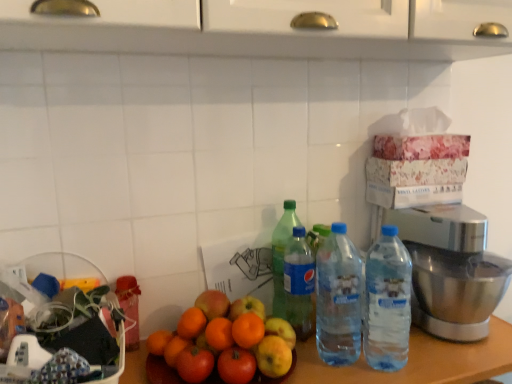
Question: Does wooden table at center touch green plastic bottle at center, arranged as the 4th bottle when viewed from the right?

Choices:
 (A) yes
 (B) no

Answer: (B)

Question: Can you confirm if wooden table at center is wider than green plastic bottle at center, arranged as the first bottle when viewed from the left?

Choices:
 (A) yes
 (B) no

Answer: (A)

Question: From a real-world perspective, is wooden table at center below green plastic bottle at center, arranged as the first bottle when viewed from the left?

Choices:
 (A) no
 (B) yes

Answer: (B)

Question: Would you say wooden table at center is outside green plastic bottle at center, arranged as the first bottle when viewed from the left?

Choices:
 (A) yes
 (B) no

Answer: (A)

Question: Does wooden table at center have a lesser height compared to green plastic bottle at center, arranged as the first bottle when viewed from the left?

Choices:
 (A) no
 (B) yes

Answer: (A)

Question: From a real-world perspective, is wooden table at center physically above green plastic bottle at center, arranged as the 4th bottle when viewed from the right?

Choices:
 (A) no
 (B) yes

Answer: (A)

Question: Does clear plastic water bottles at center-right, the first bottle positioned from the right, contain blue plastic water bottle at center, which is the 3th bottle from left to right?

Choices:
 (A) yes
 (B) no

Answer: (B)

Question: From the image's perspective, is clear plastic water bottles at center-right, the first bottle positioned from the right, on top of blue plastic water bottle at center, which is the 3th bottle from left to right?

Choices:
 (A) no
 (B) yes

Answer: (A)

Question: Is clear plastic water bottles at center-right, placed as the 4th bottle when sorted from left to right, placed right next to blue plastic water bottle at center, placed as the second bottle when sorted from right to left?

Choices:
 (A) yes
 (B) no

Answer: (A)

Question: Does clear plastic water bottles at center-right, the first bottle positioned from the right, turn towards blue plastic water bottle at center, placed as the second bottle when sorted from right to left?

Choices:
 (A) yes
 (B) no

Answer: (B)

Question: Is clear plastic water bottles at center-right, placed as the 4th bottle when sorted from left to right, closer to camera compared to blue plastic water bottle at center, which is the 3th bottle from left to right?

Choices:
 (A) yes
 (B) no

Answer: (A)

Question: Is the position of clear plastic water bottles at center-right, placed as the 4th bottle when sorted from left to right, more distant than that of blue plastic water bottle at center, which is the 3th bottle from left to right?

Choices:
 (A) no
 (B) yes

Answer: (A)

Question: From a real-world perspective, is green plastic bottle at center, arranged as the 4th bottle when viewed from the right, over polished stainless steel mixer at right?

Choices:
 (A) yes
 (B) no

Answer: (A)